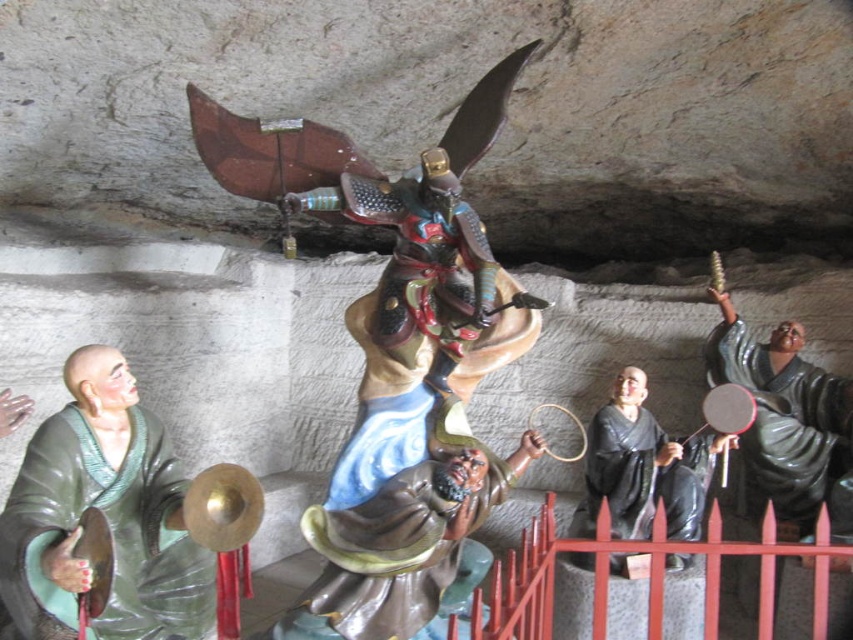
You are an explorer in a dark cave. You see a smooth brown statue at center and a black glossy monk at center. Which object is larger?

The smooth brown statue at center is bigger than the black glossy monk at center according to the description.

You are an explorer in a dark cave. You see a green matte monk statue at left and a red metal fence at lower center. Which object is higher up from the ground?

The green matte monk statue at left is located above the red metal fence at lower center, so it is higher up from the ground.